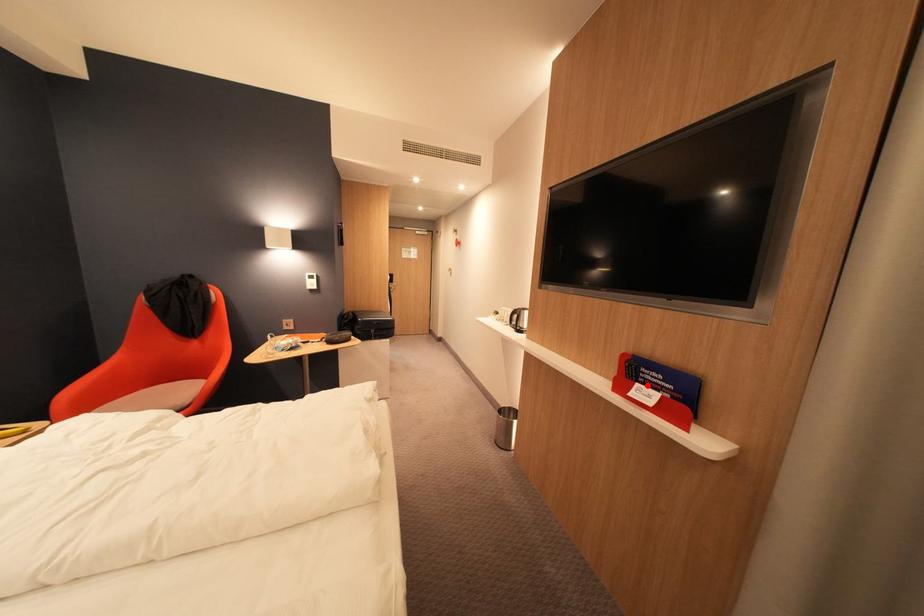
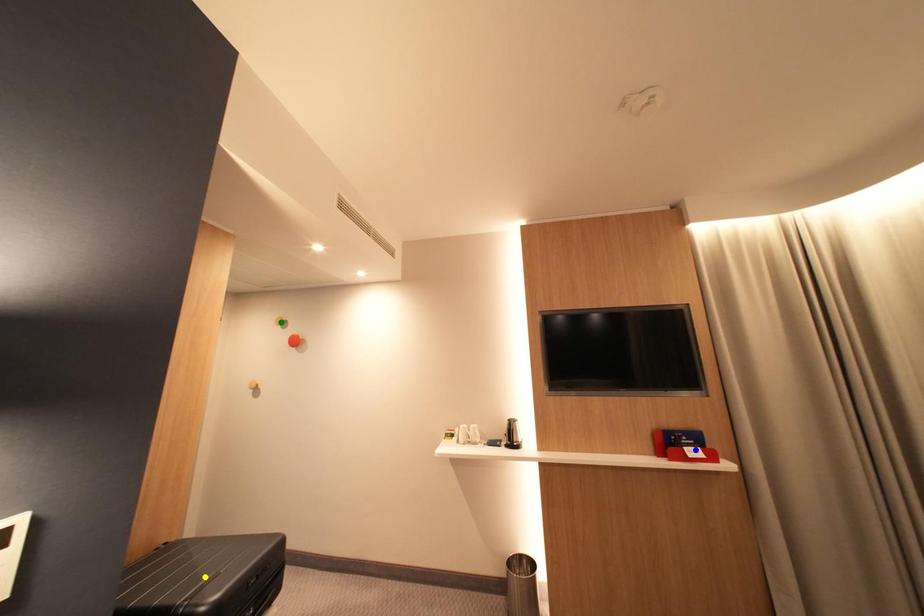
Question: I am providing you with two images of the same scene from different viewpoints. A red point is marked on the first image. You are given multiple points on the second image. Can you choose the point in image 2 that corresponds to the point in image 1?

Choices:
 (A) yellow point
 (B) blue point
 (C) green point

Answer: (B)